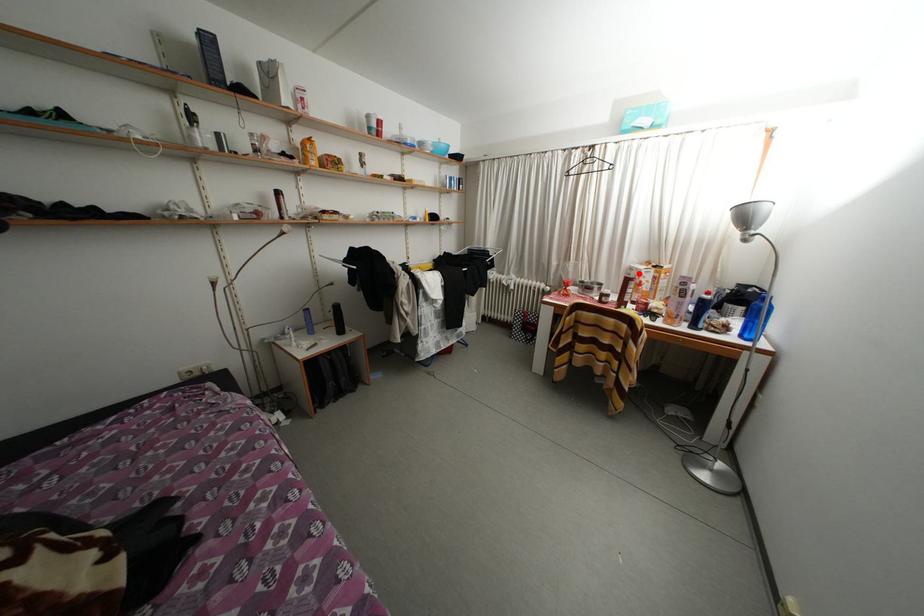
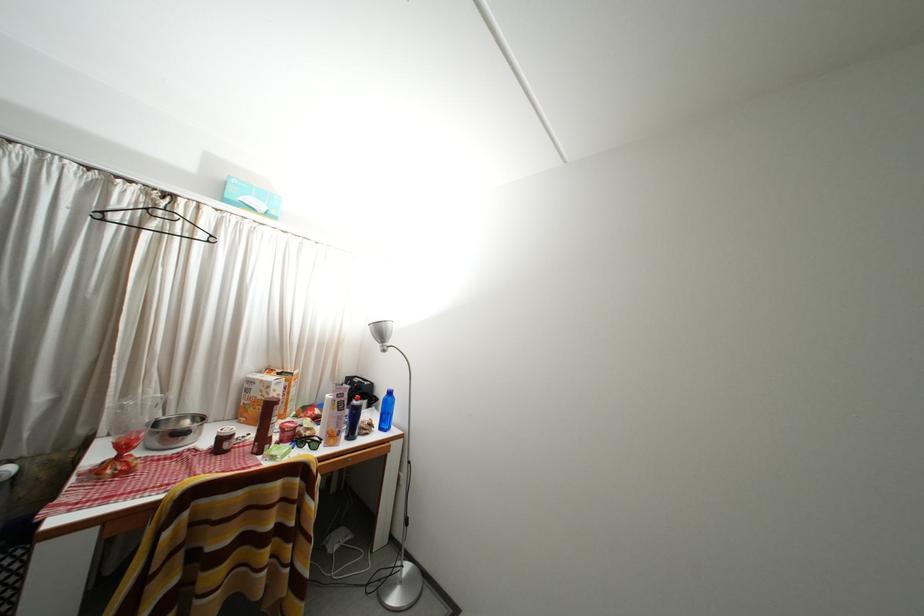
Question: I am providing you with two images of the same scene from different viewpoints. A red point is shown in image1. For the corresponding object point in image2, is it positioned nearer or farther from the camera?

Choices:
 (A) Nearer
 (B) Farther

Answer: (B)